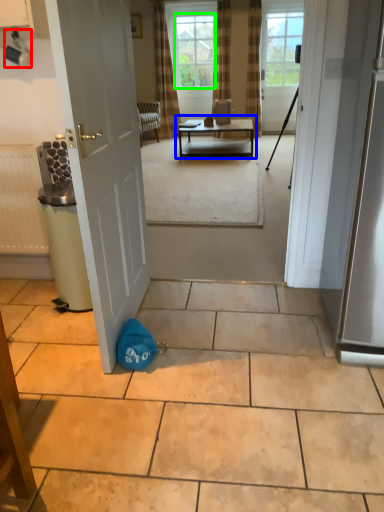
Question: Which is nearer to the coffee cup (highlighted by a red box)? table (highlighted by a blue box) or window screen (highlighted by a green box).

Choices:
 (A) table
 (B) window screen

Answer: (A)